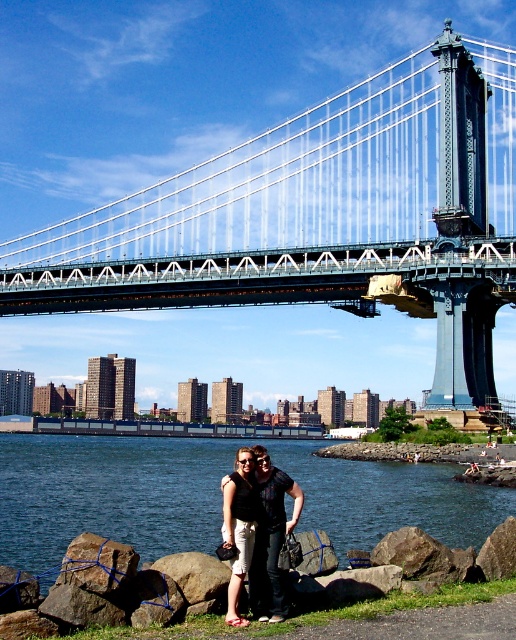
Question: Which object appears closest to the camera in this image?

Choices:
 (A) metallic gray suspension bridge at center
 (B) smooth gray rock at lower center
 (C) matte black shorts at center

Answer: (C)

Question: Can you confirm if metallic gray suspension bridge at center is thinner than smooth gray rock at lower center?

Choices:
 (A) no
 (B) yes

Answer: (A)

Question: Can you confirm if blue water at lower left is positioned to the right of smooth gray rock at lower center?

Choices:
 (A) no
 (B) yes

Answer: (B)

Question: Is blue water at lower left bigger than matte black shorts at center?

Choices:
 (A) yes
 (B) no

Answer: (A)

Question: Which of the following is the farthest from the observer?

Choices:
 (A) (234, 536)
 (B) (221, 278)
 (C) (215, 586)
 (D) (315, 468)

Answer: (B)

Question: Based on their relative distances, which object is farther from the metallic gray suspension bridge at center?

Choices:
 (A) blue water at lower left
 (B) matte black shorts at center

Answer: (B)